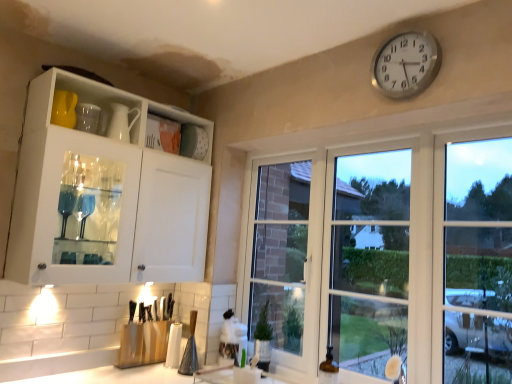
Question: Is silver metallic clock at upper right inside white glossy cabinet at upper left?

Choices:
 (A) no
 (B) yes

Answer: (A)

Question: Is the position of white glossy cabinet at upper left more distant than that of silver metallic clock at upper right?

Choices:
 (A) yes
 (B) no

Answer: (A)

Question: Are white glossy cabinet at upper left and silver metallic clock at upper right beside each other?

Choices:
 (A) no
 (B) yes

Answer: (A)

Question: Is white glossy cabinet at upper left at the left side of silver metallic clock at upper right?

Choices:
 (A) no
 (B) yes

Answer: (B)

Question: From a real-world perspective, is white glossy cabinet at upper left located higher than silver metallic clock at upper right?

Choices:
 (A) yes
 (B) no

Answer: (B)

Question: Is white glossy cabinet at upper left turned away from silver metallic clock at upper right?

Choices:
 (A) no
 (B) yes

Answer: (A)

Question: Is silver metallic clock at upper right behind white glossy cabinet at upper left?

Choices:
 (A) no
 (B) yes

Answer: (A)

Question: Can you confirm if silver metallic clock at upper right is taller than white glossy cabinet at upper left?

Choices:
 (A) no
 (B) yes

Answer: (A)

Question: From a real-world perspective, is silver metallic clock at upper right located higher than white glossy cabinet at upper left?

Choices:
 (A) yes
 (B) no

Answer: (A)

Question: Is silver metallic clock at upper right not near white glossy cabinet at upper left?

Choices:
 (A) yes
 (B) no

Answer: (A)

Question: Can you confirm if silver metallic clock at upper right is thinner than white glossy cabinet at upper left?

Choices:
 (A) no
 (B) yes

Answer: (B)

Question: Is silver metallic clock at upper right to the left of white glossy cabinet at upper left from the viewer's perspective?

Choices:
 (A) yes
 (B) no

Answer: (B)

Question: Is clear glass windows at center at the left side of white glossy cabinet at upper left?

Choices:
 (A) no
 (B) yes

Answer: (A)